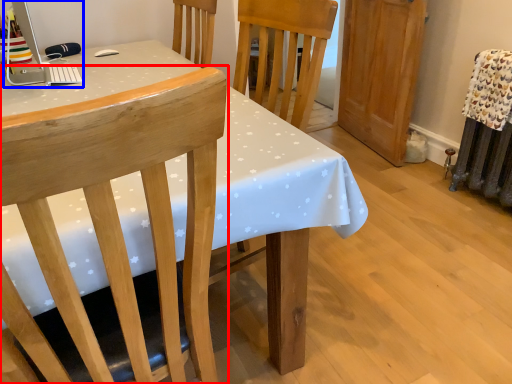
Question: Which of the following is the farthest to the observer, chair (highlighted by a red box) or desktop computer (highlighted by a blue box)?

Choices:
 (A) chair
 (B) desktop computer

Answer: (B)